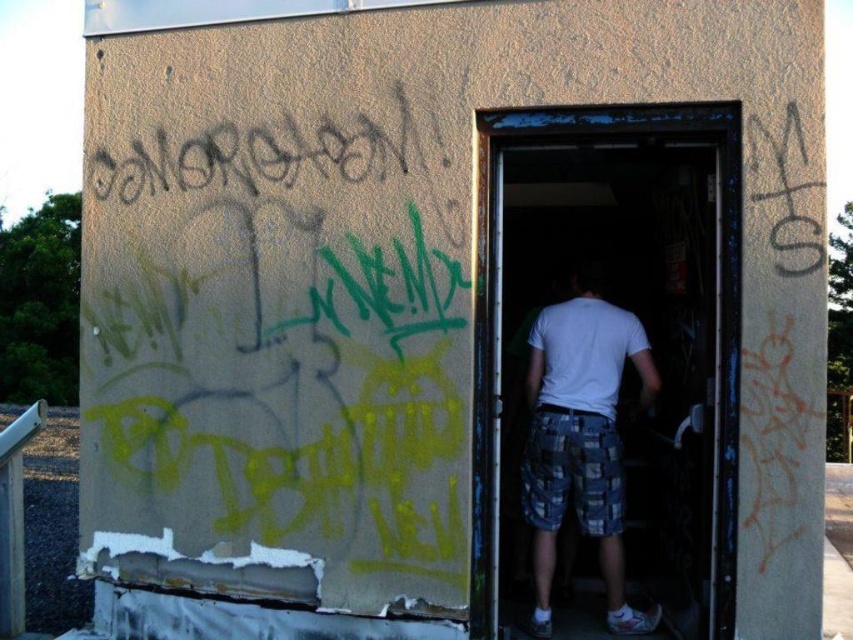
Question: Is wooden door at center wider than white cotton shirt at center?

Choices:
 (A) no
 (B) yes

Answer: (B)

Question: Which point is closer to the camera taking this photo?

Choices:
 (A) (683, 525)
 (B) (611, 324)

Answer: (B)

Question: Among these objects, which one is nearest to the camera?

Choices:
 (A) white cotton shirt at center
 (B) wooden door at center

Answer: (B)

Question: Is wooden door at center thinner than white cotton shirt at center?

Choices:
 (A) yes
 (B) no

Answer: (B)

Question: Considering the relative positions of wooden door at center and white cotton shirt at center in the image provided, where is wooden door at center located with respect to white cotton shirt at center?

Choices:
 (A) left
 (B) right

Answer: (A)